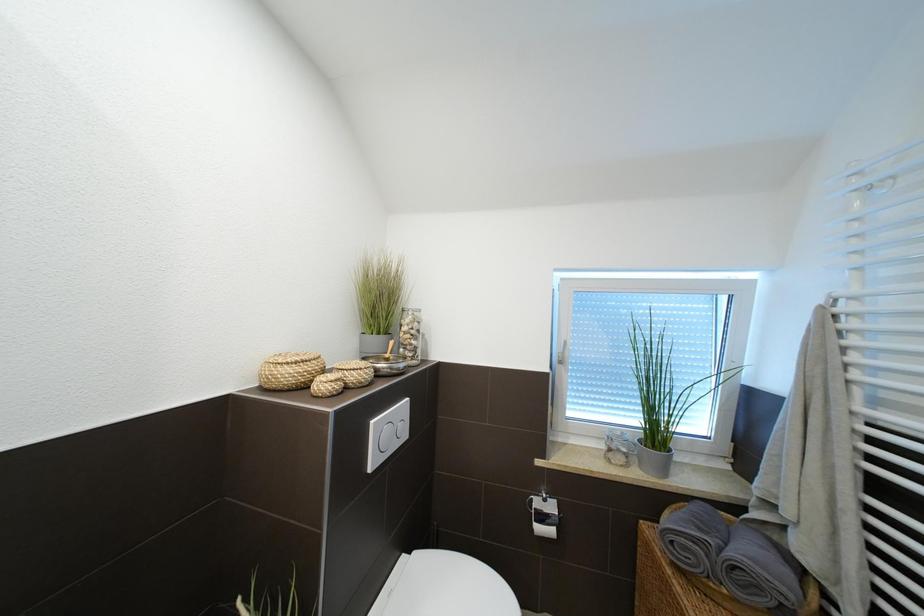
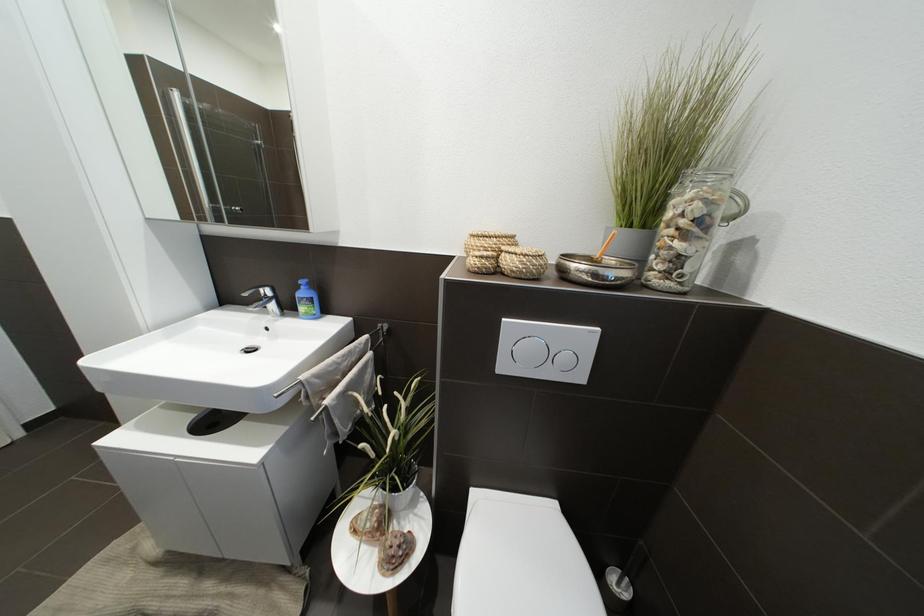
The images are taken continuously from a first-person perspective. In which direction is your viewpoint rotating?

The camera's rotation is toward left-down.